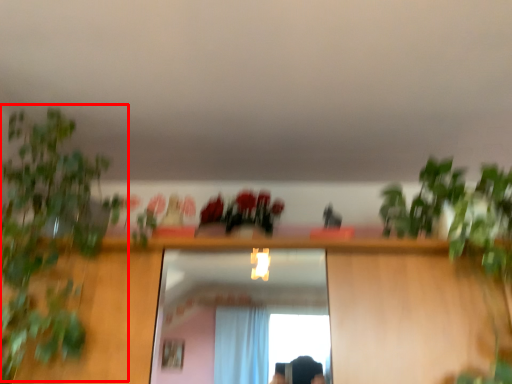
Question: From the image's perspective, what is the correct spatial positioning of vegetation (annotated by the red box) in reference to flower?

Choices:
 (A) above
 (B) below

Answer: (B)